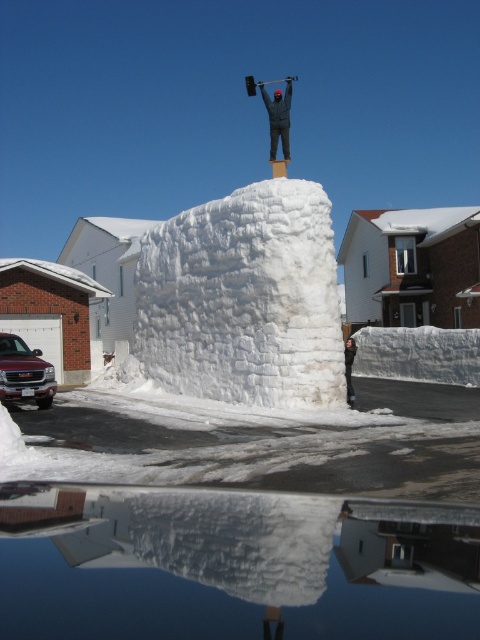
You are trying to determine if the dark gray fabric at center can cover the dark gray fabric jacket at center completely. Based on their sizes, is this possible?

The dark gray fabric at center might be wider than dark gray fabric jacket at center, so it could potentially cover it, but there is uncertainty due to the comparative size description using the word

You are an observer looking at the snow sculpture scene. You notice two items labeled as dark gray fabric at center and dark gray fabric jacket at center. Which one is positioned to the right of the other?

The dark gray fabric at center is positioned to the right of the dark gray fabric jacket at center.

You are standing in the winter scene and want to touch the dark gray fabric at center and the dark gray fabric jacket at center. Which one can you reach first without moving your feet?

The dark gray fabric at center can be reached first because it is closer to you than the dark gray fabric jacket at center.